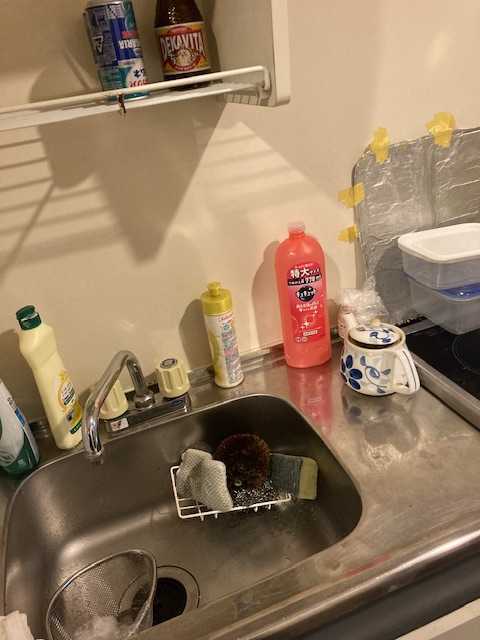
At what (x,y) coordinates should I click in order to perform the action: click on shelf. Please return your answer as a coordinate pair (x, y). The height and width of the screenshot is (640, 480). Looking at the image, I should click on (154, 93).